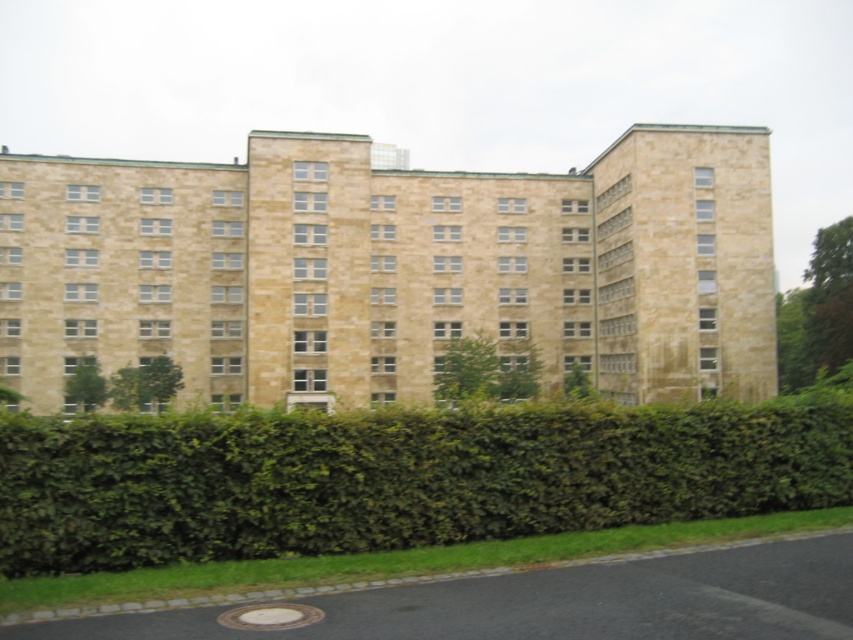
Does green leafy hedge at lower center come behind green leafy bush at left?

No, it is in front of green leafy bush at left.

Who is more forward, (850, 454) or (100, 378)?

Point (850, 454) is in front.

Locate an element on the screen. This screenshot has height=640, width=853. green leafy hedge at lower center is located at coordinates (396, 477).

Can you confirm if green leafy bush at center is thinner than green leafy bush at left?

Incorrect, green leafy bush at center's width is not less than green leafy bush at left's.

Who is lower down, green leafy bush at center or green leafy bush at left?

green leafy bush at left is below.

Is point (521, 392) positioned in front of point (79, 356)?

Yes, it is.

You are a GUI agent. You are given a task and a screenshot of the screen. Output one action in this format:
    pyautogui.click(x=<x>, y=<y>)
    Task: Click on the green leafy bush at center
    Image resolution: width=853 pixels, height=640 pixels.
    Given the screenshot: What is the action you would take?
    pyautogui.click(x=485, y=371)

From the picture: Who is shorter, green leafy hedge at lower center or green leafy bush at center?

Standing shorter between the two is green leafy hedge at lower center.

Is green leafy hedge at lower center thinner than green leafy bush at center?

Yes.

Does point (401, 531) come farther from viewer compared to point (490, 380)?

That is False.

Where is `green leafy hedge at lower center`? This screenshot has height=640, width=853. green leafy hedge at lower center is located at coordinates (396, 477).